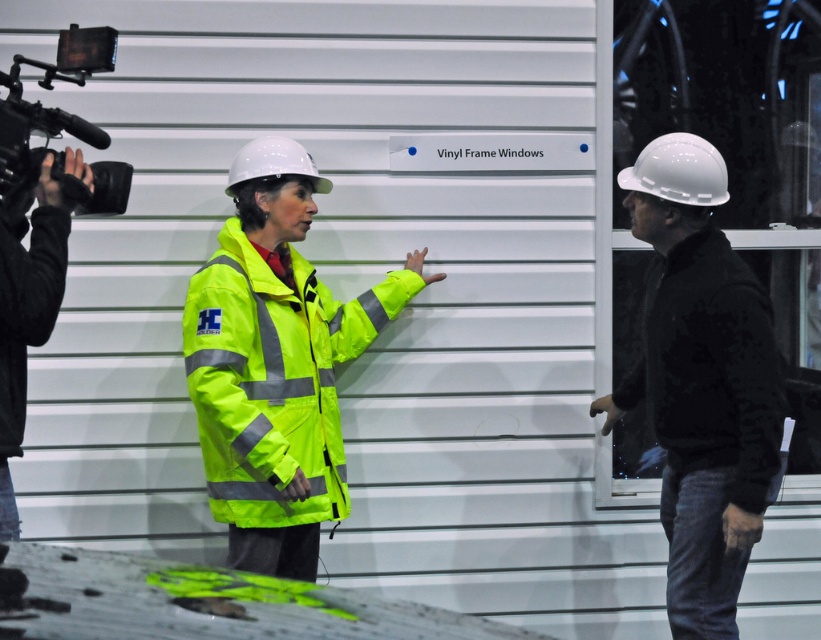
From the picture: You are a safety inspector assessing the visibility of workers in this scene. The neon yellow reflective jacket at center and the black fabric camera at left are both in your line of sight. Which object is shorter in height?

The neon yellow reflective jacket at center has a lesser height compared to the black fabric camera at left, so the neon yellow reflective jacket at center is shorter.